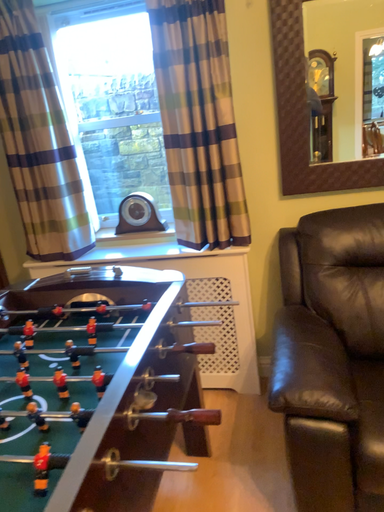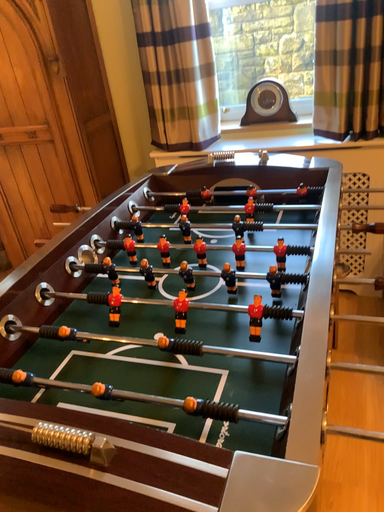
Question: Which way did the camera rotate in the video?

Choices:
 (A) rotated downward
 (B) rotated upward

Answer: (A)